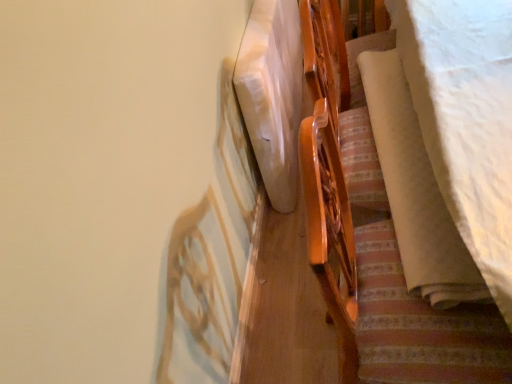
In order to click on white soft fabric at right in this screenshot , I will do `click(416, 191)`.

This screenshot has width=512, height=384. What are the coordinates of `wooden bed frame at upper right` in the screenshot? It's located at (422, 327).

You are a GUI agent. You are given a task and a screenshot of the screen. Output one action in this format:
    pyautogui.click(x=<x>, y=<y>)
    Task: Click on the white matte mattress at center
    The width and height of the screenshot is (512, 384).
    Given the screenshot: What is the action you would take?
    pyautogui.click(x=272, y=95)

From the image's perspective, which is above, wooden bed frame at upper right or white matte mattress at center?

white matte mattress at center appears higher in the image.

Considering the sizes of objects wooden bed frame at upper right and white matte mattress at center in the image provided, who is taller, wooden bed frame at upper right or white matte mattress at center?

wooden bed frame at upper right.

Is wooden bed frame at upper right aimed at white matte mattress at center?

No.

The image size is (512, 384). Find the location of `blanket located above the wooden bed frame at upper right (from the image's perspective)`. blanket located above the wooden bed frame at upper right (from the image's perspective) is located at coordinates pyautogui.click(x=416, y=191).

Is white soft fabric at right bigger or smaller than wooden bed frame at upper right?

In the image, white soft fabric at right appears to be smaller than wooden bed frame at upper right.

From a real-world perspective, is white soft fabric at right located higher than wooden bed frame at upper right?

Correct, in the physical world, white soft fabric at right is higher than wooden bed frame at upper right.

From the image's perspective, is white matte mattress at center above or below white soft fabric at right?

From the image's perspective, white matte mattress at center appears above white soft fabric at right.

Which is more to the left, white matte mattress at center or white soft fabric at right?

white matte mattress at center.

Consider the image. Is white matte mattress at center located outside white soft fabric at right?

Yes, white matte mattress at center is not within white soft fabric at right.

Is white matte mattress at center oriented towards white soft fabric at right?

Yes, white matte mattress at center faces towards white soft fabric at right.

From the image's perspective, is white soft fabric at right positioned above or below white matte mattress at center?

From the image's perspective, white soft fabric at right appears below white matte mattress at center.

Is white soft fabric at right to the left of white matte mattress at center from the viewer's perspective?

No.

Who is taller, white soft fabric at right or white matte mattress at center?

Standing taller between the two is white matte mattress at center.

Do you think white soft fabric at right is within white matte mattress at center, or outside of it?

The correct answer is: outside.

Which of these two, wooden bed frame at upper right or white soft fabric at right, is smaller?

Smaller between the two is white soft fabric at right.

From the picture: Considering the sizes of wooden bed frame at upper right and white soft fabric at right in the image, is wooden bed frame at upper right wider or thinner than white soft fabric at right?

wooden bed frame at upper right is wider than white soft fabric at right.

From the picture: How different are the orientations of wooden bed frame at upper right and white soft fabric at right in degrees?

3.37 degrees separate the facing orientations of wooden bed frame at upper right and white soft fabric at right.

From a real-world perspective, is wooden bed frame at upper right on top of white soft fabric at right?

Incorrect, from a real-world perspective, wooden bed frame at upper right is lower than white soft fabric at right.

Could you tell me if white matte mattress at center is turned towards wooden bed frame at upper right?

No, white matte mattress at center does not turn towards wooden bed frame at upper right.

Where is `furniture below the white matte mattress at center (from the image's perspective)`? The width and height of the screenshot is (512, 384). furniture below the white matte mattress at center (from the image's perspective) is located at coordinates (422, 327).

Which object is positioned more to the left, white matte mattress at center or wooden bed frame at upper right?

white matte mattress at center.

Find the location of `linen that is on the left side of wooden bed frame at upper right`. linen that is on the left side of wooden bed frame at upper right is located at coordinates (272, 95).

In the image, there is a wooden bed frame at upper right. Identify the location of blanket above it (from the image's perspective). (416, 191).

When comparing their distances from white matte mattress at center, does wooden bed frame at upper right or white soft fabric at right seem further?

white soft fabric at right lies further to white matte mattress at center than the other object.

Considering their positions, is white matte mattress at center positioned further to wooden bed frame at upper right than white soft fabric at right?

Among the two, white matte mattress at center is located further to wooden bed frame at upper right.

Considering their positions, is white soft fabric at right positioned closer to white matte mattress at center than wooden bed frame at upper right?

wooden bed frame at upper right is positioned closer to the anchor white matte mattress at center.

Looking at this image, considering their positions, is white soft fabric at right positioned further to wooden bed frame at upper right than white matte mattress at center?

white matte mattress at center.

Looking at the image, which one is located closer to white soft fabric at right, wooden bed frame at upper right or white matte mattress at center?

wooden bed frame at upper right lies closer to white soft fabric at right than the other object.

Estimate the real-world distances between objects in this image. Which object is closer to white soft fabric at right, white matte mattress at center or wooden bed frame at upper right?

wooden bed frame at upper right lies closer to white soft fabric at right than the other object.

What are the coordinates of `blanket between wooden bed frame at upper right and white matte mattress at center from front to back` in the screenshot? It's located at (416, 191).